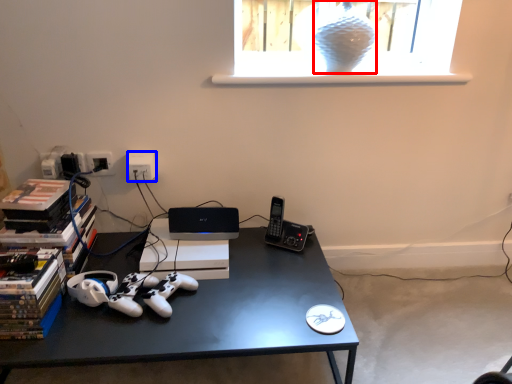
Question: Among these objects, which one is farthest to the camera, glass vase (highlighted by a red box) or electric outlet (highlighted by a blue box)?

Choices:
 (A) glass vase
 (B) electric outlet

Answer: (B)